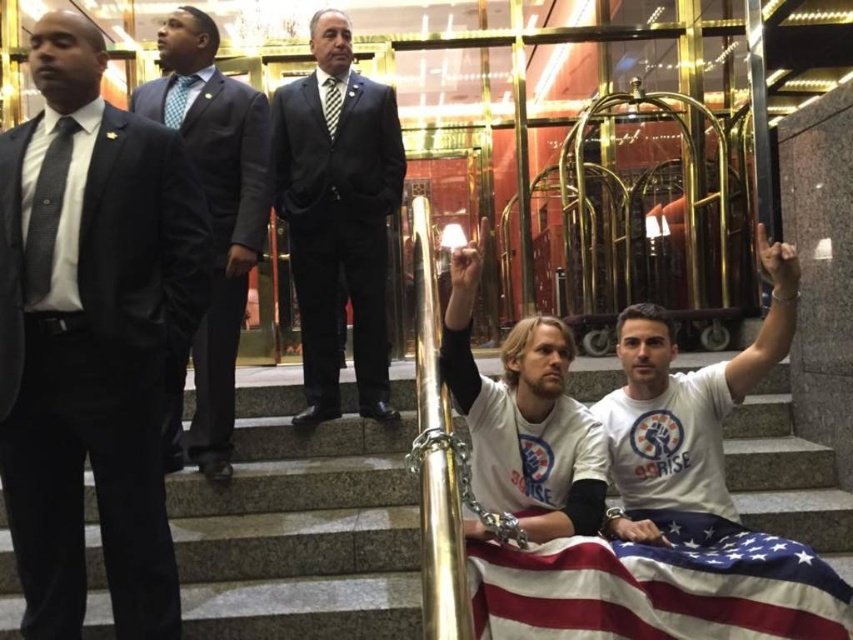
Question: Which object appears farthest from the camera in this image?

Choices:
 (A) shiny black suit at upper left
 (B) white cotton t-shirt at center
 (C) matte black suit at left
 (D) american flag at lower center

Answer: (A)

Question: Which of the following is the closest to the observer?

Choices:
 (A) (642, 440)
 (B) (155, 486)
 (C) (756, 596)
 (D) (521, 422)

Answer: (C)

Question: Can you confirm if american flag at lower center is wider than white matte t-shirt at center?

Choices:
 (A) no
 (B) yes

Answer: (B)

Question: Does shiny black suit at upper left lie behind white matte t-shirt at center?

Choices:
 (A) no
 (B) yes

Answer: (B)

Question: Which of these objects is positioned farthest from the white matte t-shirt at center?

Choices:
 (A) american flag at lower center
 (B) matte black suit at left
 (C) black suit at center

Answer: (C)

Question: Is black suit at center closer to camera compared to white matte t-shirt at center?

Choices:
 (A) yes
 (B) no

Answer: (B)